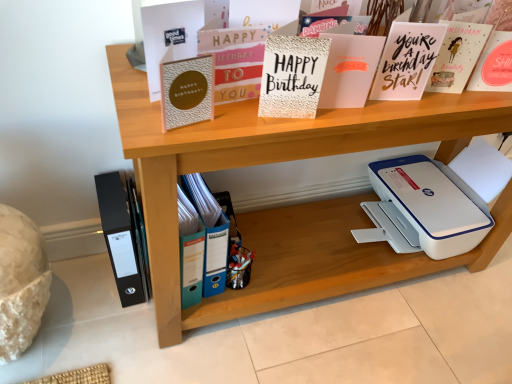
You are a GUI agent. You are given a task and a screenshot of the screen. Output one action in this format:
    pyautogui.click(x=<x>, y=<y>)
    Task: Click on the unoccupied region to the right of gold textured card at upper center, which is the sixth paperback book from right to left
    The height and width of the screenshot is (384, 512).
    Given the screenshot: What is the action you would take?
    pyautogui.click(x=242, y=123)